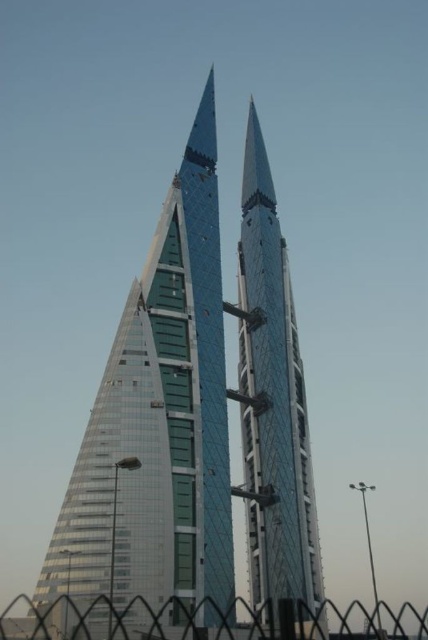
Question: Which of the following is the farthest from the observer?

Choices:
 (A) metallic chain-link fence at lower center
 (B) glassy steel skyscraper at center

Answer: (B)

Question: Among these objects, which one is nearest to the camera?

Choices:
 (A) metallic chain-link fence at lower center
 (B) glassy steel skyscraper at center
 (C) transparent glass spire at center

Answer: (A)

Question: Observing the image, what is the correct spatial positioning of transparent glass spire at center in reference to metallic chain-link fence at lower center?

Choices:
 (A) above
 (B) below

Answer: (A)

Question: Is transparent glass spire at center in front of metallic chain-link fence at lower center?

Choices:
 (A) yes
 (B) no

Answer: (B)

Question: Observing the image, what is the correct spatial positioning of glassy steel skyscraper at center in reference to metallic chain-link fence at lower center?

Choices:
 (A) right
 (B) left

Answer: (A)

Question: Among these points, which one is farthest from the camera?

Choices:
 (A) (139, 488)
 (B) (258, 477)

Answer: (B)